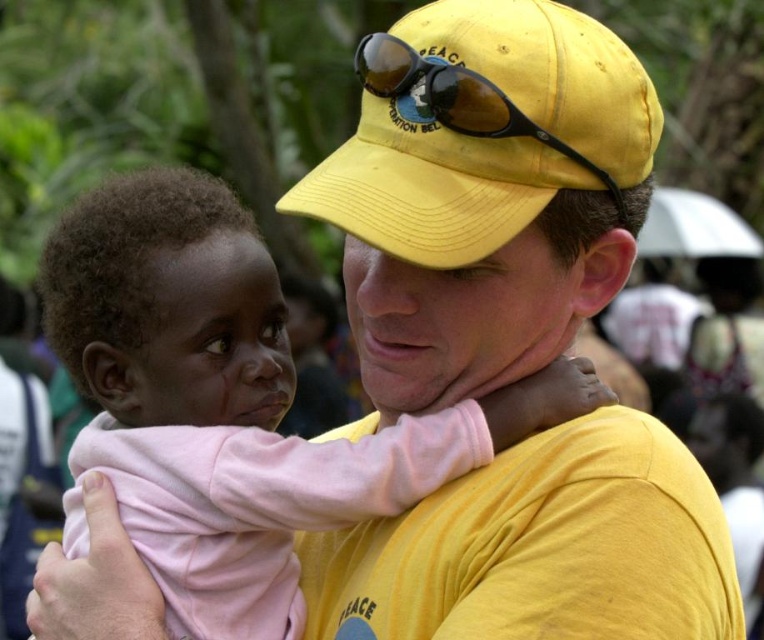
You are a photographer trying to capture a candid shot of the pink fleece baby at center and the yellow matte sunglasses at center. Since you want to ensure both subjects are in focus, you need to know their relative sizes. Which object is larger?

The pink fleece baby at center is bigger than the yellow matte sunglasses at center, so you should adjust your camera settings to accommodate the larger subject for better focus.

You are a photographer trying to capture a candid shot of the two subjects in the scene. You notice the pink fleece baby at center and the yellow matte sunglasses at center. Which object should you focus on first if you want to ensure the taller one is in sharp focus?

The pink fleece baby at center is taller than the yellow matte sunglasses at center, so you should focus on the pink fleece baby at center first to ensure it is in sharp focus.